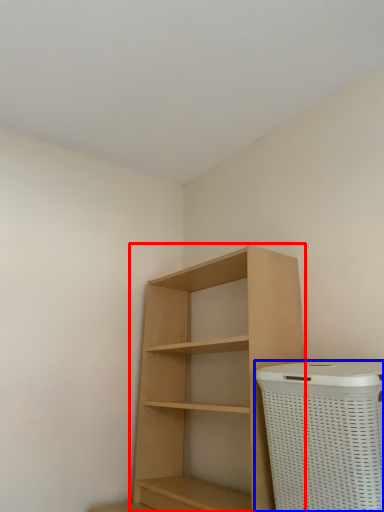
Question: Which object appears farthest to the camera in this image, shelf (highlighted by a red box) or basket container (highlighted by a blue box)?

Choices:
 (A) shelf
 (B) basket container

Answer: (A)